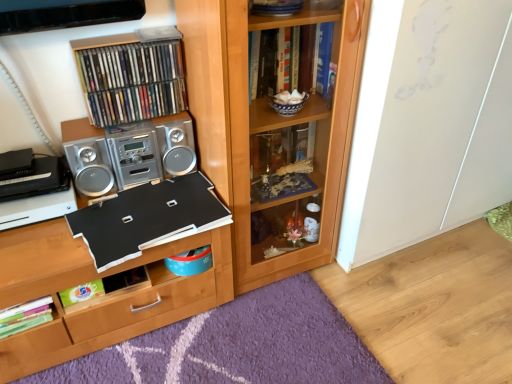
The image size is (512, 384). Identify the location of empty space that is ontop of silver metallic stereo at center (from a real-world perspective). (128, 123).